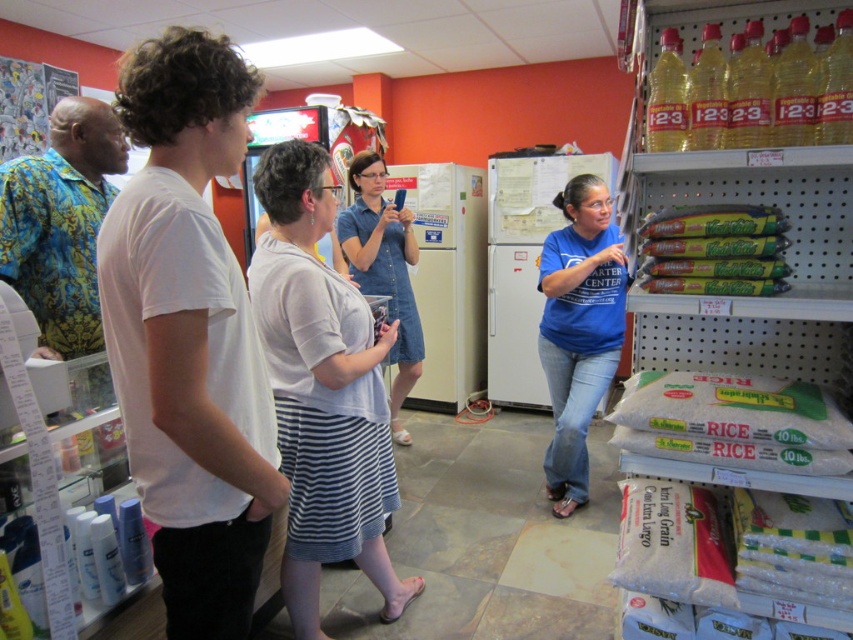
You are a delivery person who needs to place a package between the green matte fresh pasta at right and the denim dress at center. The package requires 5 feet of space. Is there enough space between them?

The green matte fresh pasta at right and denim dress at center are 6.42 feet apart from each other. Since the package requires 5 feet of space, there is enough space between them to place the package.

You are standing at the entrance of the store and want to approach the person wearing the white cotton shirt at center. According to the coordinates provided, in which direction should you move from your current position at the entrance?

The white cotton shirt at center is located at coordinates point (322, 392). Since you are at the entrance, you should move towards the center of the store to reach them.